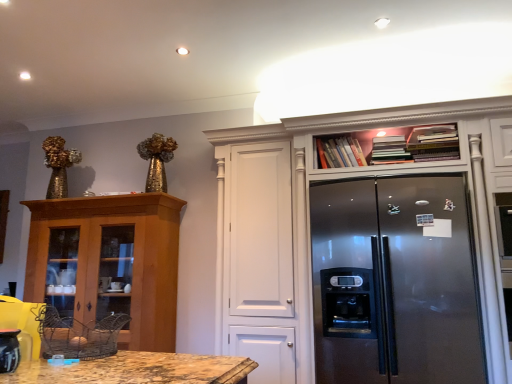
Question: Is satin silver refrigerator at center spatially inside wooden cabinet at left, positioned as the second cabinetry in right-to-left order, or outside of it?

Choices:
 (A) inside
 (B) outside

Answer: (B)

Question: Based on their positions, is satin silver refrigerator at center located to the left or right of wooden cabinet at left, positioned as the second cabinetry in right-to-left order?

Choices:
 (A) left
 (B) right

Answer: (B)

Question: Which object is positioned farthest from the wooden cabinet at left, positioned as the second cabinetry in right-to-left order?

Choices:
 (A) matte black coffee pot at lower left
 (B) satin silver refrigerator at center
 (C) satin silver refrigerator at upper right, the second cabinetry in the left-to-right sequence

Answer: (A)

Question: Considering the real-world distances, which object is closest to the wooden cabinet at left, positioned as the second cabinetry in right-to-left order?

Choices:
 (A) matte black coffee pot at lower left
 (B) satin silver refrigerator at upper right, which appears as the 1th cabinetry when viewed from the right
 (C) satin silver refrigerator at center

Answer: (B)